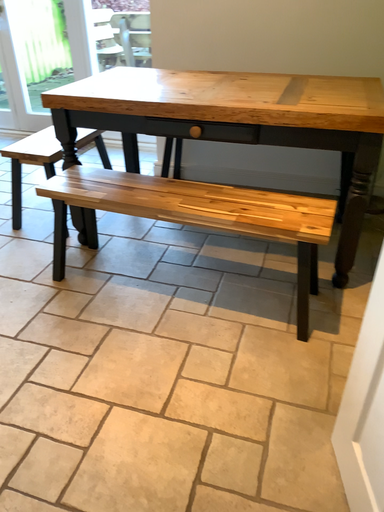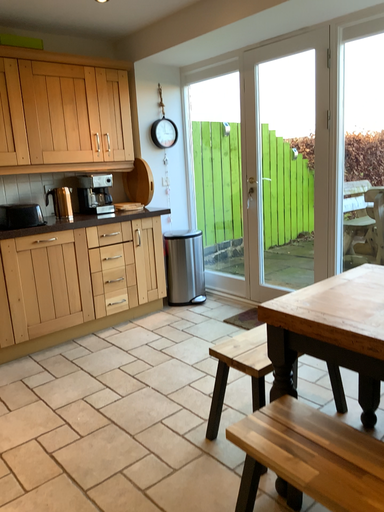
Question: Which way did the camera rotate in the video?

Choices:
 (A) rotated right
 (B) rotated left

Answer: (B)